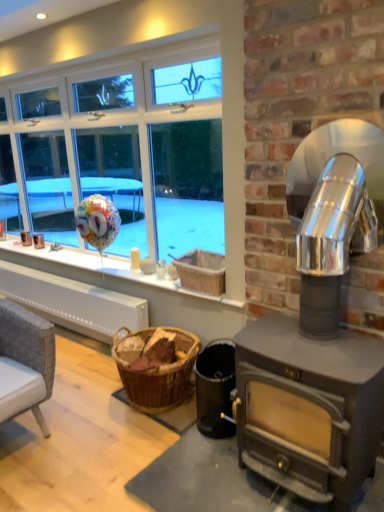
Question: Considering the positions of black matte wood stove at lower right and metallic silver fireplace at right in the image, is black matte wood stove at lower right taller or shorter than metallic silver fireplace at right?

Choices:
 (A) tall
 (B) short

Answer: (B)

Question: Do you think black matte wood stove at lower right is within metallic silver fireplace at right, or outside of it?

Choices:
 (A) outside
 (B) inside

Answer: (A)

Question: Estimate the real-world distances between objects in this image. Which object is closer to the metallic silver fireplace at right?

Choices:
 (A) black matte wood stove at lower right
 (B) wooden basket at center

Answer: (B)

Question: Based on their relative distances, which object is farther from the wooden basket at center?

Choices:
 (A) black matte wood stove at lower right
 (B) metallic silver fireplace at right

Answer: (B)